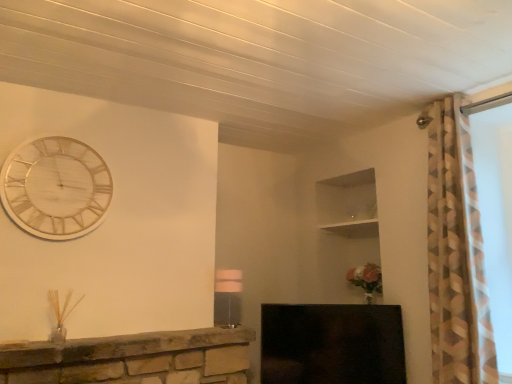
Question: Considering the positions of wooden/textured clock at upper left and black glossy fireplace at lower center in the image, is wooden/textured clock at upper left bigger or smaller than black glossy fireplace at lower center?

Choices:
 (A) small
 (B) big

Answer: (A)

Question: From a real-world perspective, relative to black glossy fireplace at lower center, is wooden/textured clock at upper left vertically above or below?

Choices:
 (A) below
 (B) above

Answer: (B)

Question: Which object is the farthest from the wooden/textured clock at upper left?

Choices:
 (A) matte white lampshade at center
 (B) black glossy fireplace at lower center

Answer: (B)

Question: Estimate the real-world distances between objects in this image. Which object is farther from the black glossy fireplace at lower center?

Choices:
 (A) matte white lampshade at center
 (B) wooden/textured clock at upper left

Answer: (B)